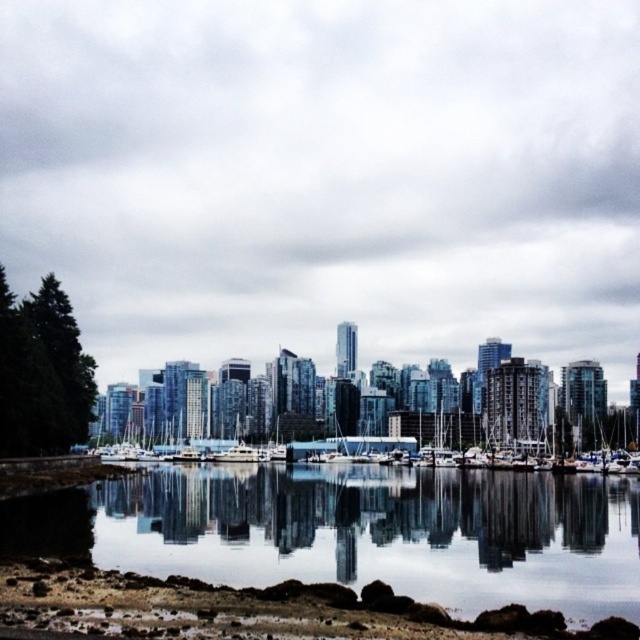
You are a photographer planning to capture the waterfront scene. You want to position your tripod on either the clear water at lower left or the bare soil at lower center. Which location offers a wider area to set up your equipment?

The clear water at lower left has a larger width than the bare soil at lower center, so it offers a wider area to set up your equipment.